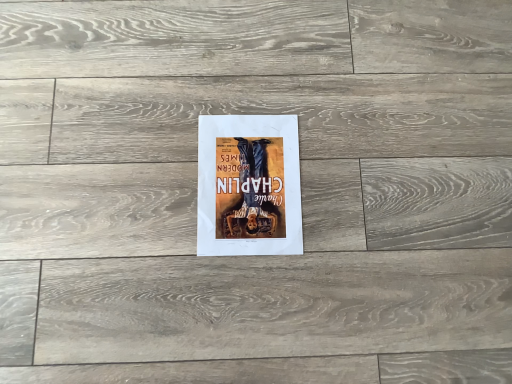
Find the location of a particular element. free location above matte paper poster at center (from a real-world perspective) is located at coordinates (245, 175).